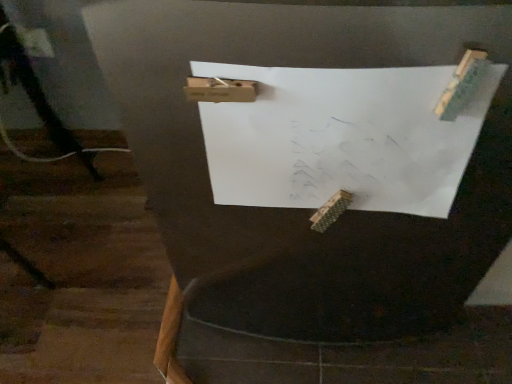
Question: From the image's perspective, is white paper at center above or below black matte tripod at lower left?

Choices:
 (A) above
 (B) below

Answer: (B)

Question: Considering the positions of white paper at center and black matte tripod at lower left in the image, is white paper at center bigger or smaller than black matte tripod at lower left?

Choices:
 (A) small
 (B) big

Answer: (A)

Question: Choose the correct answer: Is white paper at center inside black matte tripod at lower left or outside it?

Choices:
 (A) inside
 (B) outside

Answer: (B)

Question: Is black matte tripod at lower left spatially inside white paper at center, or outside of it?

Choices:
 (A) outside
 (B) inside

Answer: (A)

Question: From the image's perspective, is black matte tripod at lower left positioned above or below white paper at center?

Choices:
 (A) below
 (B) above

Answer: (B)

Question: Is point (24, 56) closer or farther from the camera than point (217, 125)?

Choices:
 (A) farther
 (B) closer

Answer: (A)

Question: Looking at their shapes, would you say black matte tripod at lower left is wider or thinner than white paper at center?

Choices:
 (A) wide
 (B) thin

Answer: (A)